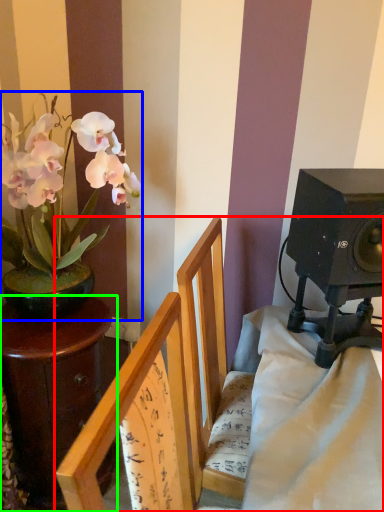
Question: Based on their relative distances, which object is farther from furniture (highlighted by a red box)? Choose from houseplant (highlighted by a blue box) and table (highlighted by a green box).

Choices:
 (A) houseplant
 (B) table

Answer: (A)